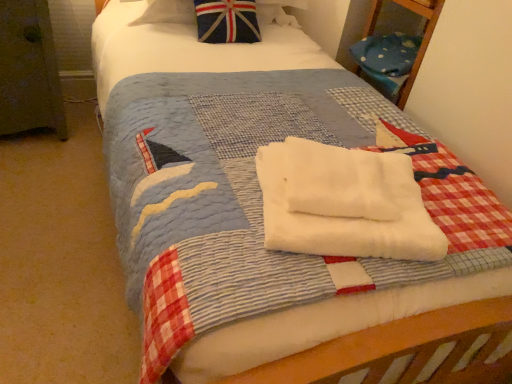
Question: Which direction should I rotate to look at white soft towel at center, the 2th beach towel in the bottom-to-top sequence?

Choices:
 (A) left
 (B) right

Answer: (B)

Question: Can you confirm if white soft towel at center, the 2th beach towel in the bottom-to-top sequence, is taller than union jack fabric pillow at upper center?

Choices:
 (A) no
 (B) yes

Answer: (A)

Question: Considering the relative sizes of white soft towel at center, which is counted as the first beach towel, starting from the top, and union jack fabric pillow at upper center in the image provided, is white soft towel at center, which is counted as the first beach towel, starting from the top, shorter than union jack fabric pillow at upper center?

Choices:
 (A) no
 (B) yes

Answer: (B)

Question: Can you confirm if white soft towel at center, the 2th beach towel in the bottom-to-top sequence, is bigger than union jack fabric pillow at upper center?

Choices:
 (A) yes
 (B) no

Answer: (B)

Question: Considering the relative positions of white soft towel at center, which is counted as the first beach towel, starting from the top, and union jack fabric pillow at upper center in the image provided, is white soft towel at center, which is counted as the first beach towel, starting from the top, to the left of union jack fabric pillow at upper center from the viewer's perspective?

Choices:
 (A) no
 (B) yes

Answer: (A)

Question: Is white soft towel at center, the 2th beach towel in the bottom-to-top sequence, at the right side of union jack fabric pillow at upper center?

Choices:
 (A) no
 (B) yes

Answer: (B)

Question: Considering the relative positions of white soft towel at center, which is counted as the first beach towel, starting from the top, and union jack fabric pillow at upper center in the image provided, is white soft towel at center, which is counted as the first beach towel, starting from the top, behind union jack fabric pillow at upper center?

Choices:
 (A) yes
 (B) no

Answer: (B)

Question: Can you confirm if union jack fabric pillow at upper center is shorter than white soft towel at center, which is the second beach towel from top to bottom?

Choices:
 (A) yes
 (B) no

Answer: (B)

Question: Does union jack fabric pillow at upper center come in front of white soft towel at center, the first beach towel ordered from the bottom?

Choices:
 (A) no
 (B) yes

Answer: (A)

Question: Is the position of union jack fabric pillow at upper center more distant than that of white soft towel at center, which is the second beach towel from top to bottom?

Choices:
 (A) yes
 (B) no

Answer: (A)

Question: Can you confirm if union jack fabric pillow at upper center is positioned to the right of white soft towel at center, the first beach towel ordered from the bottom?

Choices:
 (A) no
 (B) yes

Answer: (A)

Question: Is white soft towel at center, which is the second beach towel from top to bottom, located within union jack fabric pillow at upper center?

Choices:
 (A) yes
 (B) no

Answer: (B)

Question: From the image's perspective, is union jack fabric pillow at upper center located beneath white soft towel at center, the first beach towel ordered from the bottom?

Choices:
 (A) no
 (B) yes

Answer: (A)

Question: Is white soft towel at center, the first beach towel ordered from the bottom, in contact with white soft towel at center, which is counted as the first beach towel, starting from the top?

Choices:
 (A) yes
 (B) no

Answer: (A)